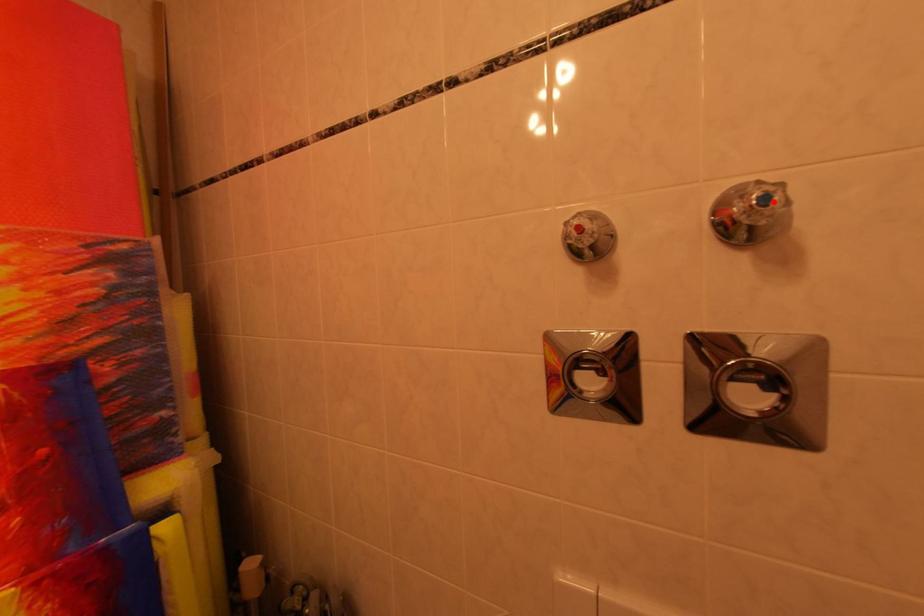
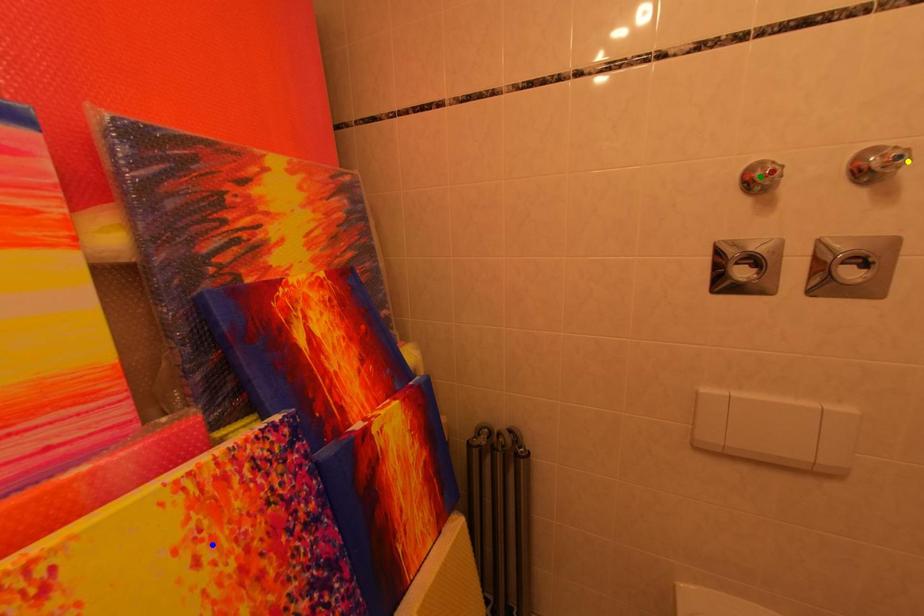
Question: I am providing you with two images of the same scene from different viewpoints. A red point is marked on the first image. You are given multiple points on the second image. Which point in image 2 represents the same 3d spot as the red point in image 1?

Choices:
 (A) yellow point
 (B) green point
 (C) blue point

Answer: (A)